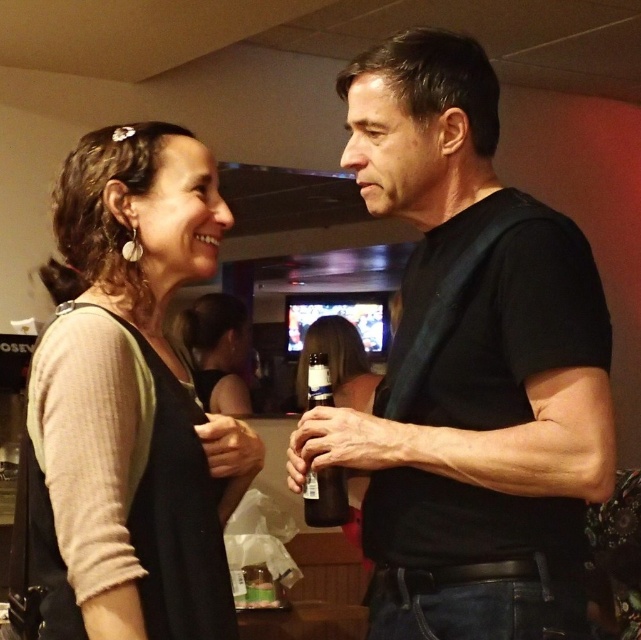
Based on the photo, who is taller, black matte shirt at center or translucent glass bottle at center?

black matte shirt at center

How distant is black matte shirt at center from translucent glass bottle at center?

black matte shirt at center and translucent glass bottle at center are 11.39 inches apart.

This screenshot has width=641, height=640. Find the location of `black matte shirt at center`. black matte shirt at center is located at coordinates [470, 369].

Is point (83, 588) behind point (201, 332)?

That is False.

Who is more forward, (74, 204) or (226, 336)?

Point (74, 204) is more forward.

Where is `matte black top at left`? This screenshot has height=640, width=641. matte black top at left is located at coordinates (131, 403).

Which of these two, black matte shirt at center or matte black top at left, stands shorter?

matte black top at left is shorter.

Is black matte shirt at center smaller than matte black top at left?

Incorrect, black matte shirt at center is not smaller in size than matte black top at left.

What do you see at coordinates (470, 369) in the screenshot?
I see `black matte shirt at center` at bounding box center [470, 369].

Locate an element on the screen. This screenshot has height=640, width=641. black matte shirt at center is located at coordinates (470, 369).